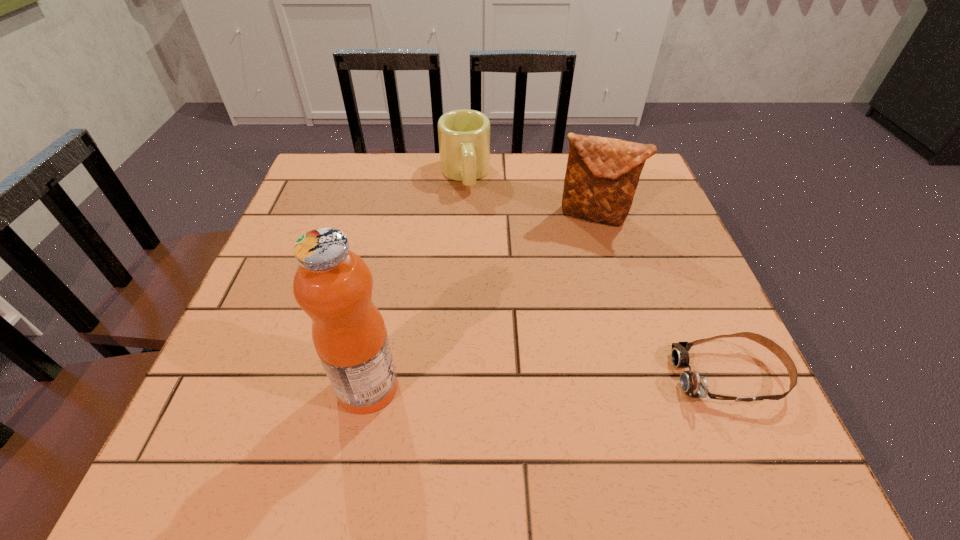
At what (x,y) coordinates should I click in order to perform the action: click on blank region between the third object from right to left and the shortest object. Please return your answer as a coordinate pair (x, y). The image size is (960, 540). Looking at the image, I should click on (597, 275).

Locate which object ranks in proximity to the shortest object. Please provide its 2D coordinates. Your answer should be formatted as a tuple, i.e. [(x, y)], where the tuple contains the x and y coordinates of a point satisfying the conditions above.

[(602, 174)]

Identify which object is the closest to the clutch bag. Please provide its 2D coordinates. Your answer should be formatted as a tuple, i.e. [(x, y)], where the tuple contains the x and y coordinates of a point satisfying the conditions above.

[(464, 135)]

This screenshot has width=960, height=540. What are the coordinates of `free spot that satisfies the following two spatial constraints: 1. on the back side of the mug; 2. on the right side of the fruit juice` in the screenshot? It's located at (410, 174).

Locate an element on the screen. This screenshot has height=540, width=960. vacant space that satisfies the following two spatial constraints: 1. on the back side of the goggles; 2. on the front-facing side of the fruit juice is located at coordinates pos(371,376).

What are the coordinates of `free region that satisfies the following two spatial constraints: 1. on the front side of the farthest object; 2. on the front-facing side of the goggles` in the screenshot? It's located at (456, 376).

This screenshot has height=540, width=960. In order to click on blank area in the image that satisfies the following two spatial constraints: 1. on the front side of the second object from left to right; 2. on the front-facing side of the goggles in this screenshot , I will do `click(456, 376)`.

At what (x,y) coordinates should I click in order to perform the action: click on blank area in the image that satisfies the following two spatial constraints: 1. on the back side of the fruit juice; 2. on the right side of the mug. Please return your answer as a coordinate pair (x, y). The height and width of the screenshot is (540, 960). Looking at the image, I should click on (410, 174).

Locate an element on the screen. The height and width of the screenshot is (540, 960). vacant area that satisfies the following two spatial constraints: 1. on the back side of the shortest object; 2. on the front-facing side of the fruit juice is located at coordinates (371, 376).

Locate an element on the screen. vacant region that satisfies the following two spatial constraints: 1. on the back side of the fruit juice; 2. on the right side of the third shortest object is located at coordinates (402, 215).